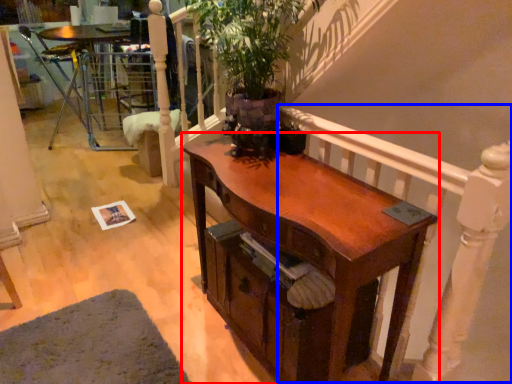
Question: Which point is further to the camera, desk (highlighted by a red box) or balustrade (highlighted by a blue box)?

Choices:
 (A) desk
 (B) balustrade

Answer: (A)